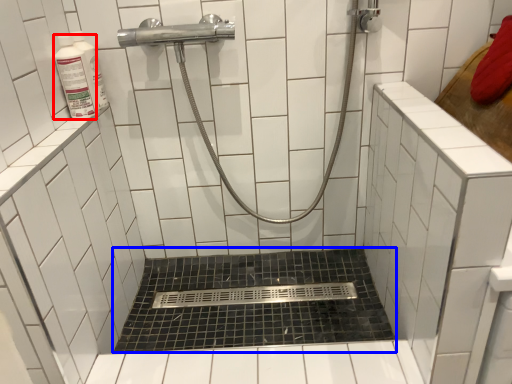
Question: Which object is further to the camera taking this photo, toiletry (highlighted by a red box) or bath (highlighted by a blue box)?

Choices:
 (A) toiletry
 (B) bath

Answer: (B)